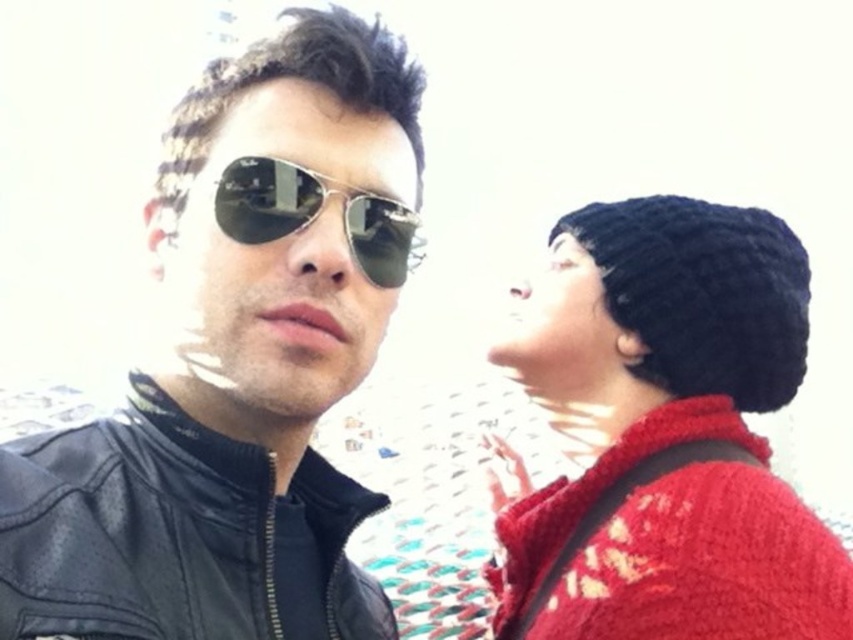
You are a photographer trying to capture both the knitted black beanie at upper right and the black leather jacket at left in a single frame. Considering their sizes, which object should you focus on to ensure both fit clearly in the photo?

The knitted black beanie at upper right is bigger than the black leather jacket at left, so you should focus on the knitted black beanie at upper right to ensure both fit clearly in the photo.

You are a photographer adjusting the focus on your camera. You want to ensure that both the knitted black beanie at upper right and the aviator sunglasses at lower left are in sharp focus. Given their positions, which object should you focus on to achieve the best depth of field?

You should focus on the knitted black beanie at upper right because it is farther away from the camera than the aviator sunglasses at lower left, ensuring the depth of field captures both objects clearly.

You are a fashion designer observing the two leather jackets in the image. The leather jacket at center and the black leather jacket at left are part of a photoshoot. Which jacket is positioned higher in the frame?

The leather jacket at center is located above the black leather jacket at left, so it is positioned higher in the frame.